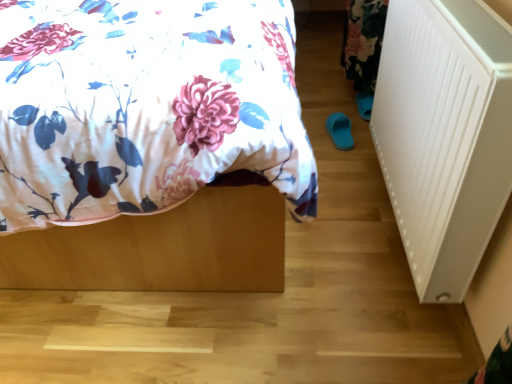
Question: Is white plastic radiator at right wider or thinner than floral fabric bed at center?

Choices:
 (A) thin
 (B) wide

Answer: (A)

Question: In the image, is white plastic radiator at right on the left side or the right side of floral fabric bed at center?

Choices:
 (A) left
 (B) right

Answer: (B)

Question: Is white plastic radiator at right situated inside floral fabric bed at center or outside?

Choices:
 (A) inside
 (B) outside

Answer: (B)

Question: From the image's perspective, is floral fabric bed at center located above or below white plastic radiator at right?

Choices:
 (A) above
 (B) below

Answer: (A)

Question: In terms of size, does floral fabric bed at center appear bigger or smaller than white plastic radiator at right?

Choices:
 (A) small
 (B) big

Answer: (B)

Question: In the image, is floral fabric bed at center positioned in front of or behind white plastic radiator at right?

Choices:
 (A) front
 (B) behind

Answer: (A)

Question: Does point (91, 238) appear closer or farther from the camera than point (396, 182)?

Choices:
 (A) farther
 (B) closer

Answer: (B)